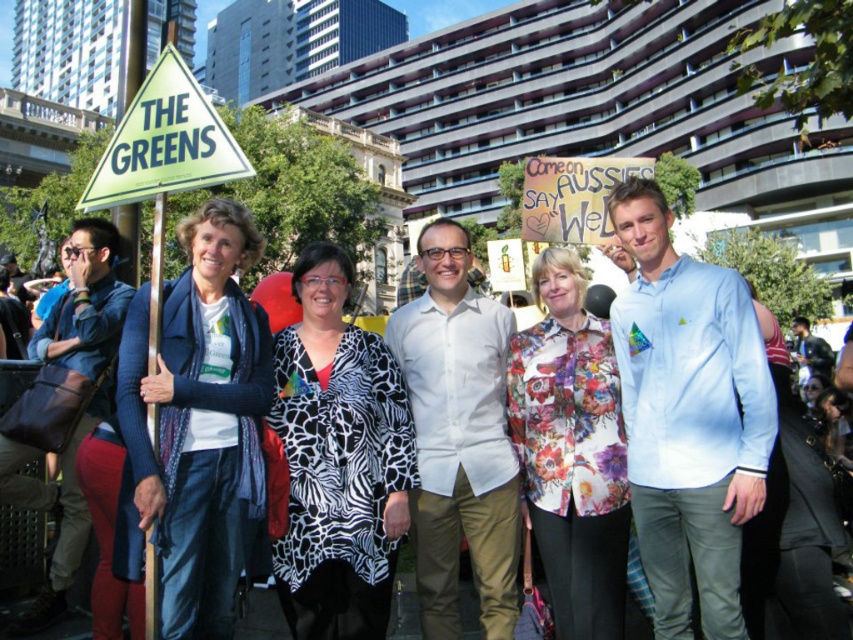
Does blue woolen scarf at left appear on the left side of zebra print coat at center?

Yes, blue woolen scarf at left is to the left of zebra print coat at center.

Which is below, blue woolen scarf at left or zebra print coat at center?

Positioned lower is zebra print coat at center.

Is point (195, 401) positioned before point (328, 397)?

Yes, it is in front of point (328, 397).

At what (x,y) coordinates should I click in order to perform the action: click on blue woolen scarf at left. Please return your answer as a coordinate pair (x, y). Looking at the image, I should click on (200, 422).

Can you confirm if zebra print coat at center is positioned to the left of floral print blouse at center?

Correct, you'll find zebra print coat at center to the left of floral print blouse at center.

Between point (355, 625) and point (531, 362), which one is positioned in front?

Point (355, 625) is in front.

Describe the element at coordinates (338, 460) in the screenshot. The width and height of the screenshot is (853, 640). I see `zebra print coat at center` at that location.

This screenshot has height=640, width=853. In order to click on zebra print coat at center in this screenshot , I will do `click(338, 460)`.

Who is more distant from viewer, (193, 301) or (573, 525)?

The point (573, 525) is behind.

Who is taller, blue woolen scarf at left or floral print blouse at center?

blue woolen scarf at left

The image size is (853, 640). Describe the element at coordinates (200, 422) in the screenshot. I see `blue woolen scarf at left` at that location.

You are a GUI agent. You are given a task and a screenshot of the screen. Output one action in this format:
    pyautogui.click(x=<x>, y=<y>)
    Task: Click on the blue woolen scarf at left
    
    Given the screenshot: What is the action you would take?
    pyautogui.click(x=200, y=422)